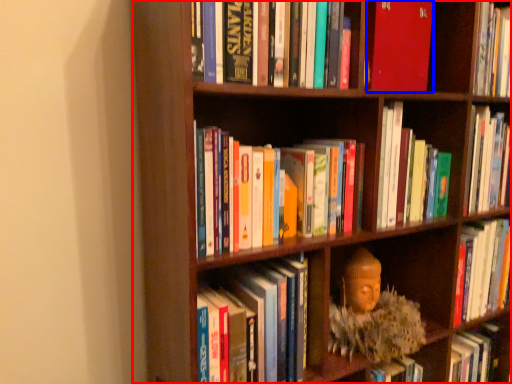
Question: Which of the following is the farthest to the observer, bookcase (highlighted by a red box) or book (highlighted by a blue box)?

Choices:
 (A) bookcase
 (B) book

Answer: (B)